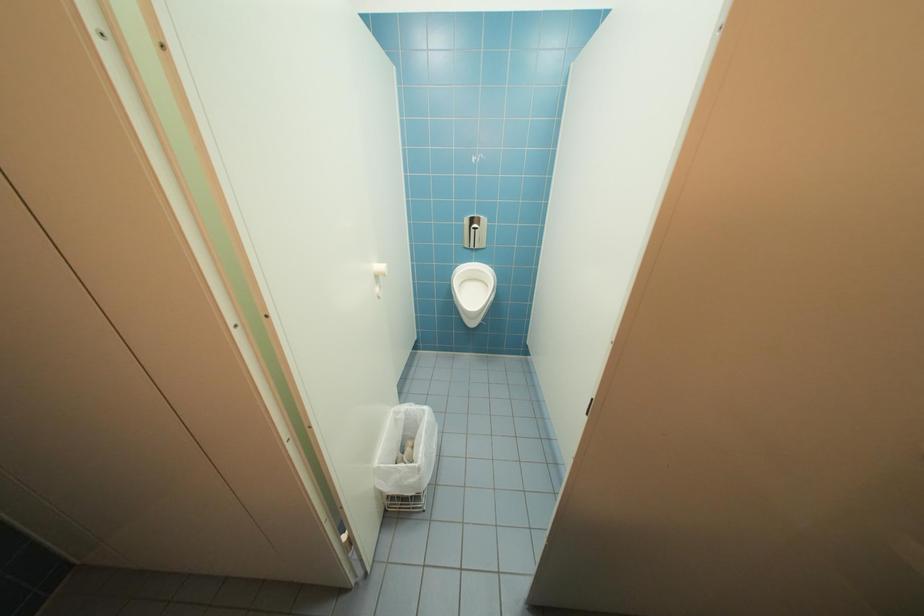
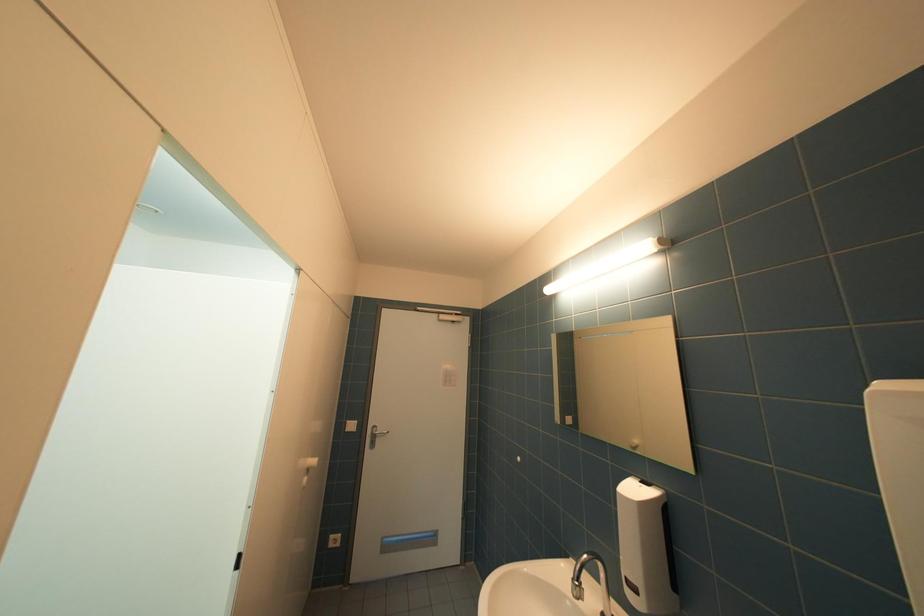
Question: The camera is either moving clockwise (left) or counter-clockwise (right) around the object. The first image is from the beginning of the video and the second image is from the end. Is the camera moving left or right when shooting the video?

Choices:
 (A) Left
 (B) Right

Answer: (A)